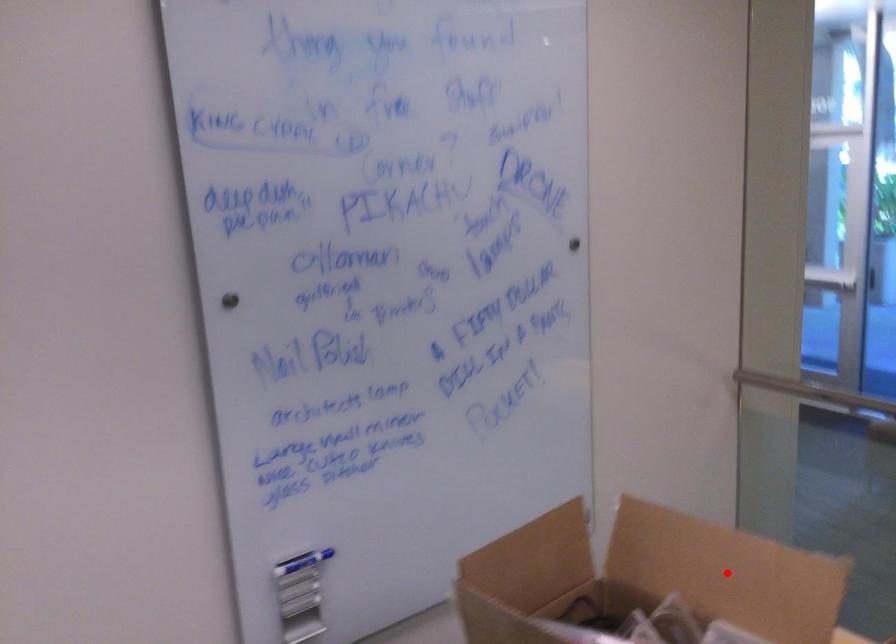
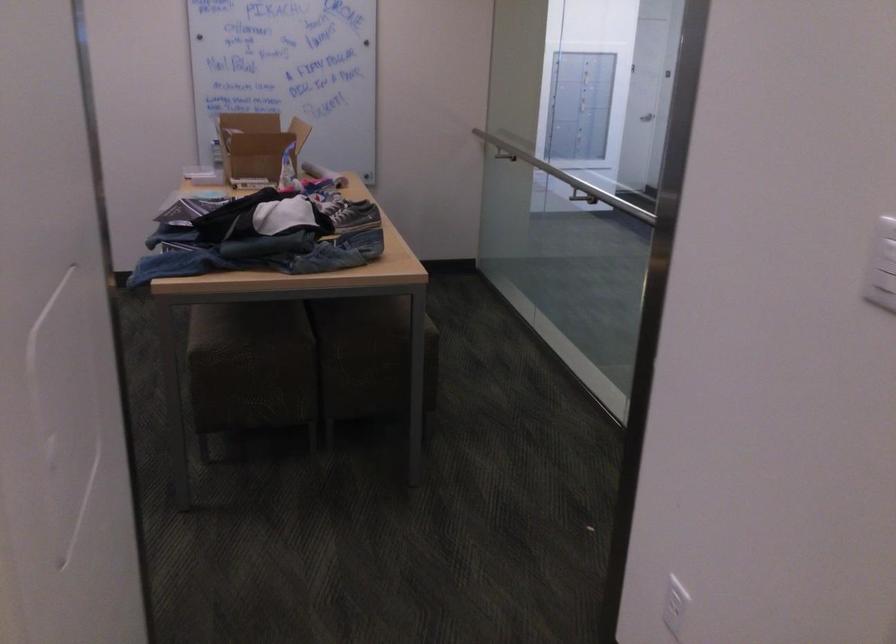
Question: I am providing you with two images of the same scene from different viewpoints. A red point is marked on the first image. At the location where the point appears in image 1, is it still visible in image 2?

Choices:
 (A) Yes
 (B) No

Answer: (B)